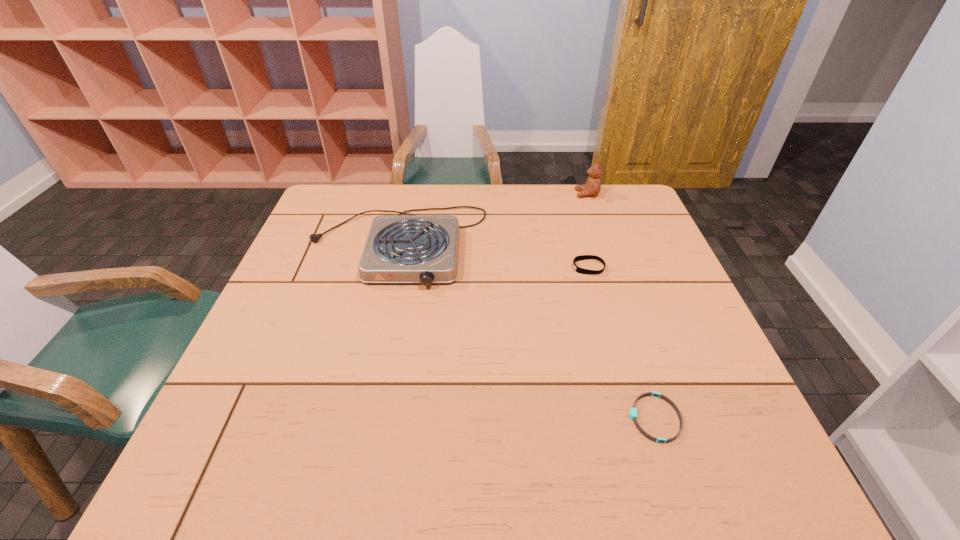
Locate an element on the screen. free space at the right edge of the desktop is located at coordinates (670, 261).

You are a GUI agent. You are given a task and a screenshot of the screen. Output one action in this format:
    pyautogui.click(x=<x>, y=<y>)
    Task: Click on the vacant space at the far left corner of the desktop
    This screenshot has width=960, height=540.
    Given the screenshot: What is the action you would take?
    pyautogui.click(x=366, y=208)

The image size is (960, 540). I want to click on free location at the near right corner of the desktop, so click(x=736, y=458).

Where is `empty space between the farther wristband and the shortest object`? empty space between the farther wristband and the shortest object is located at coordinates (621, 343).

Locate an element on the screen. Image resolution: width=960 pixels, height=540 pixels. free point between the teddy bear and the leftmost object is located at coordinates (492, 220).

Identify the location of vacant space that is in between the third tallest object and the nearer wristband. The width and height of the screenshot is (960, 540). (621, 343).

The height and width of the screenshot is (540, 960). Identify the location of vacant area between the second shortest object and the tallest object. (588, 231).

Find the location of `free area in between the nearest object and the tallest object`. free area in between the nearest object and the tallest object is located at coordinates (620, 306).

Where is `blank region between the farther wristband and the hotplate`? This screenshot has width=960, height=540. blank region between the farther wristband and the hotplate is located at coordinates point(492,256).

You are a GUI agent. You are given a task and a screenshot of the screen. Output one action in this format:
    pyautogui.click(x=<x>, y=<y>)
    Task: Click on the vacant area that lies between the nearest object and the second shortest object
    The image size is (960, 540).
    Given the screenshot: What is the action you would take?
    pyautogui.click(x=621, y=343)